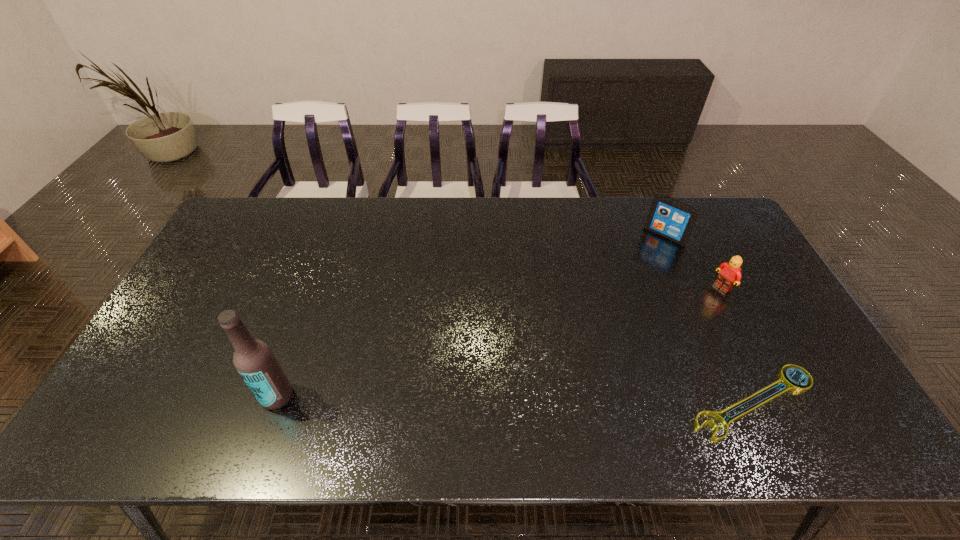
Where is `vacant region located on the front screen of the iPod`? vacant region located on the front screen of the iPod is located at coordinates (622, 283).

You are a GUI agent. You are given a task and a screenshot of the screen. Output one action in this format:
    pyautogui.click(x=<x>, y=<y>)
    Task: Click on the vacant space situated 0.160m on the front screen of the iPod
    
    Given the screenshot: What is the action you would take?
    pyautogui.click(x=635, y=269)

What are the coordinates of `vacant space located 0.250m on the face of the Lego` in the screenshot? It's located at (657, 325).

Find the location of a particular element. Image resolution: width=960 pixels, height=540 pixels. free space located on the face of the Lego is located at coordinates (636, 336).

The image size is (960, 540). What are the coordinates of `free space located on the face of the Lego` in the screenshot? It's located at (644, 332).

Where is `object that is at the far edge`? object that is at the far edge is located at coordinates (672, 219).

Identify the location of beer bottle located in the near edge section of the desktop. (254, 360).

Locate an element on the screen. The height and width of the screenshot is (540, 960). wrench that is at the near edge is located at coordinates (792, 385).

Locate an element on the screen. wrench at the right edge is located at coordinates (792, 385).

Find the location of a particular element. Lego at the right edge is located at coordinates (730, 274).